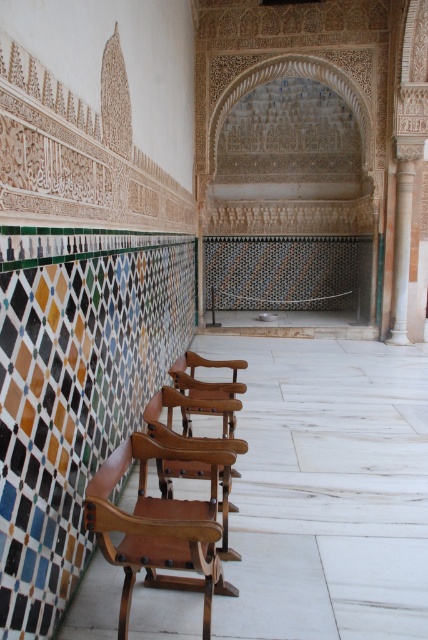
You are standing in the interior space with intricate Islamic architectural details. You notice two points marked in the scene. The first point is at coordinate point (136, 448) and the second is at point (407, 176). From your perspective, which point is closer to you?

Point (136, 448) is in front of point (407, 176), so it is closer to you.

Consider the image. You are a visitor standing between the brown leather chair at left and the green marble column at right. You want to place a 7.5 meter long decorative banner between them. Will the banner fit perfectly between the two objects without overlapping either?

The distance between the brown leather chair at left and the green marble column at right is 7.55 meters. Since the banner is 7.5 meters long, it will fit perfectly with a small gap of 0.05 meters remaining between them.